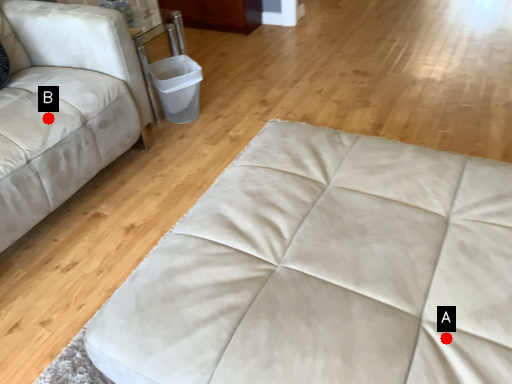
Question: Two points are circled on the image, labeled by A and B beside each circle. Which of the following is the closest to the observer?

Choices:
 (A) A is closer
 (B) B is closer

Answer: (A)